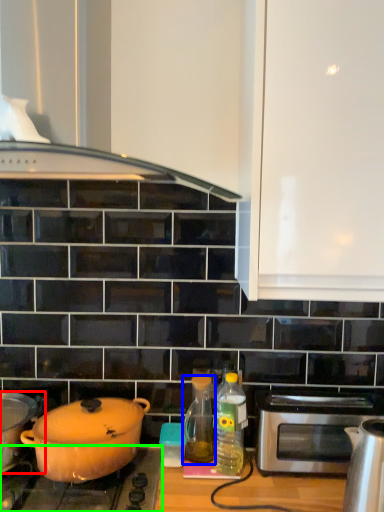
Question: Estimate the real-world distances between objects in this image. Which object is farther from kitchen appliance (highlighted by a red box), bottle (highlighted by a blue box) or gas stove (highlighted by a green box)?

Choices:
 (A) bottle
 (B) gas stove

Answer: (A)